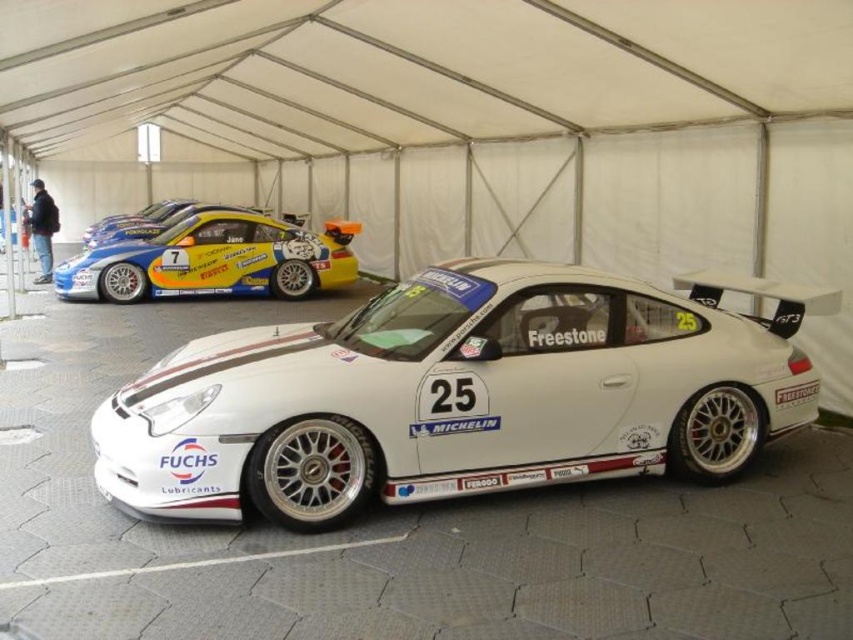
Question: Among these objects, which one is nearest to the camera?

Choices:
 (A) yellow/golden metallic race car at upper left
 (B) white matte race car at center

Answer: (B)

Question: Is white matte race car at center below yellow/golden metallic race car at upper left?

Choices:
 (A) no
 (B) yes

Answer: (B)

Question: In this image, where is white matte race car at center located relative to yellow/golden metallic race car at upper left?

Choices:
 (A) below
 (B) above

Answer: (A)

Question: Is white matte race car at center above yellow/golden metallic race car at upper left?

Choices:
 (A) yes
 (B) no

Answer: (B)